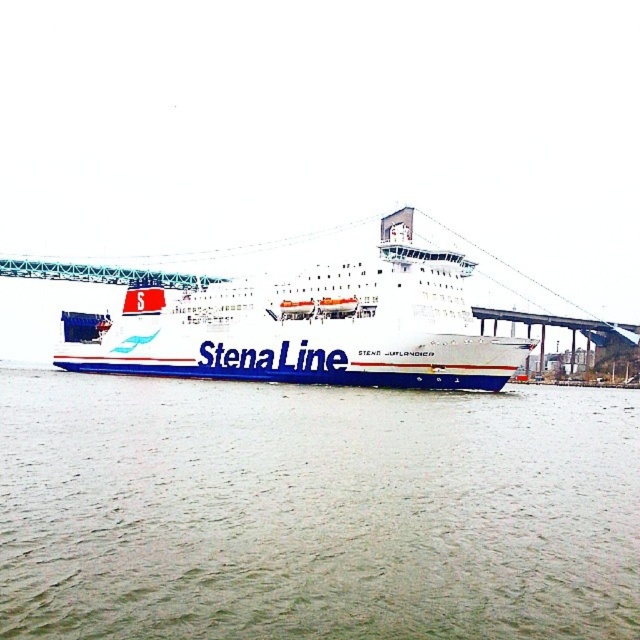
Can you confirm if green water at center is positioned above white matte ship at center?

No, green water at center is not above white matte ship at center.

What do you see at coordinates (314, 509) in the screenshot? Image resolution: width=640 pixels, height=640 pixels. I see `green water at center` at bounding box center [314, 509].

You are a GUI agent. You are given a task and a screenshot of the screen. Output one action in this format:
    pyautogui.click(x=<x>, y=<y>)
    Task: Click on the green water at center
    Image resolution: width=640 pixels, height=640 pixels.
    Given the screenshot: What is the action you would take?
    pyautogui.click(x=314, y=509)